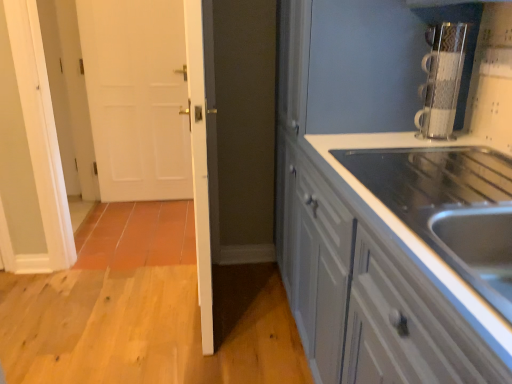
In order to click on white glossy cabinet at right in this screenshot , I will do `click(393, 200)`.

What is the approximate width of white glossy cabinet at right?

white glossy cabinet at right is 27.00 inches wide.

Describe the element at coordinates (393, 200) in the screenshot. I see `white glossy cabinet at right` at that location.

Find the location of `white glossy cabinet at right`. white glossy cabinet at right is located at coordinates (393, 200).